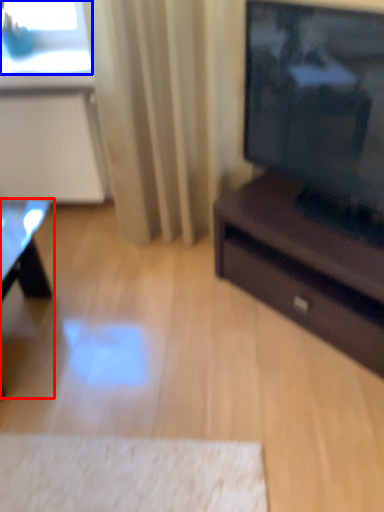
Question: Among these objects, which one is farthest to the camera, table (highlighted by a red box) or window screen (highlighted by a blue box)?

Choices:
 (A) table
 (B) window screen

Answer: (B)